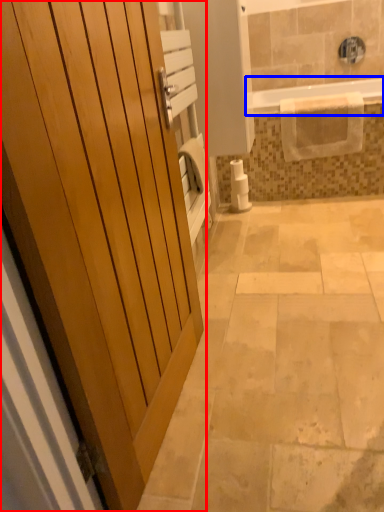
Question: Among these objects, which one is nearest to the camera, door (highlighted by a red box) or bathtub (highlighted by a blue box)?

Choices:
 (A) door
 (B) bathtub

Answer: (A)